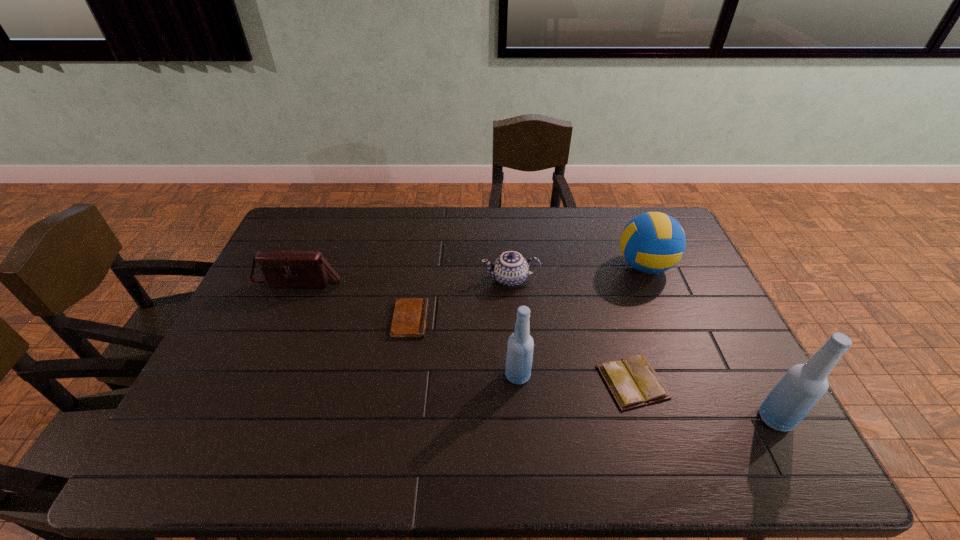
The image size is (960, 540). What are the coordinates of `free point between the shoulder bag and the sixth object from right to left` in the screenshot? It's located at (355, 300).

The height and width of the screenshot is (540, 960). Find the location of `free space that is in between the volleyball and the third shortest object`. free space that is in between the volleyball and the third shortest object is located at coordinates (x=578, y=273).

Identify the location of free space between the fifth shortest object and the shoulder bag. Image resolution: width=960 pixels, height=540 pixels. (473, 273).

Where is `vacant space that is in between the leftmost object and the right bottle`? The width and height of the screenshot is (960, 540). vacant space that is in between the leftmost object and the right bottle is located at coordinates (539, 350).

At what (x,y) coordinates should I click in order to perform the action: click on vacant area between the chinaware and the left bottle. Please return your answer as a coordinate pair (x, y). The image size is (960, 540). Looking at the image, I should click on (514, 327).

Where is `free spot between the volleyball and the rightmost object`? The height and width of the screenshot is (540, 960). free spot between the volleyball and the rightmost object is located at coordinates (710, 342).

I want to click on free space between the fifth tallest object and the second tallest object, so click(x=514, y=327).

This screenshot has width=960, height=540. Find the location of `blank region between the fourth farthest object and the volleyball`. blank region between the fourth farthest object and the volleyball is located at coordinates (527, 293).

Find the location of a particular element. Image resolution: width=960 pixels, height=540 pixels. free area in between the right bottle and the left diary is located at coordinates (592, 369).

Find the location of a particular element. object that ranks as the fourth closest to the shoulder bag is located at coordinates point(633,382).